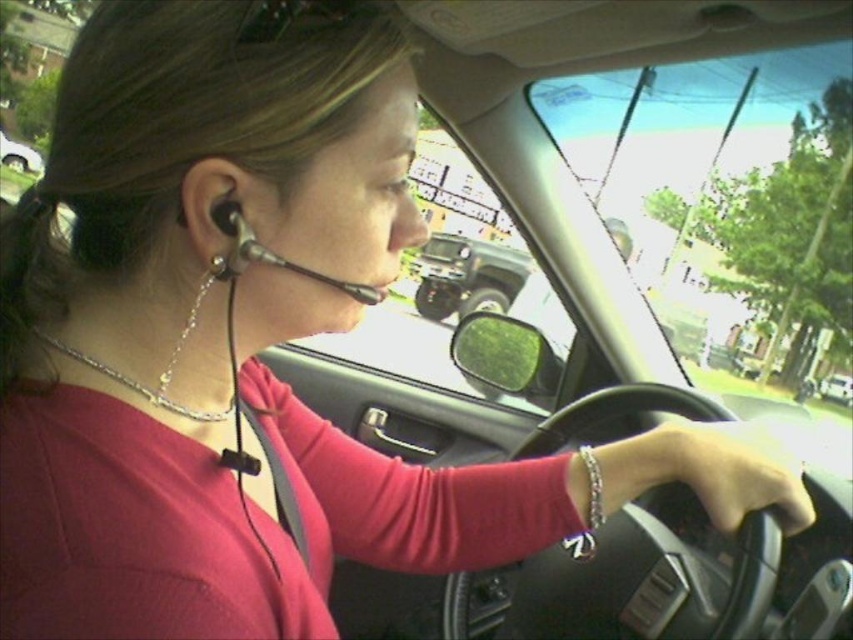
Consider the image. Can you confirm if black rubber steering wheel at center is positioned below matte black headset at upper left?

Yes, black rubber steering wheel at center is below matte black headset at upper left.

Between black rubber steering wheel at center and matte black headset at upper left, which one appears on the right side from the viewer's perspective?

black rubber steering wheel at center

Between point (556, 627) and point (7, 141), which one is positioned behind?

Positioned behind is point (7, 141).

This screenshot has height=640, width=853. Identify the location of black rubber steering wheel at center. (647, 586).

Based on the photo, does black rubber steering wheel at center have a lesser width compared to metallic silver car at center?

Correct, black rubber steering wheel at center's width is less than metallic silver car at center's.

Which of these two, black rubber steering wheel at center or metallic silver car at center, stands shorter?

With less height is metallic silver car at center.

Measure the distance between black rubber steering wheel at center and camera.

black rubber steering wheel at center is 24.07 inches away from camera.

Image resolution: width=853 pixels, height=640 pixels. Find the location of `black rubber steering wheel at center`. black rubber steering wheel at center is located at coordinates (647, 586).

Identify the location of green matte truck at center. (467, 275).

Is green matte truck at center positioned at the back of black matte earphone at left?

Yes, it is.

Find the location of a particular element. green matte truck at center is located at coordinates (467, 275).

In order to click on green matte truck at center in this screenshot , I will do `click(467, 275)`.